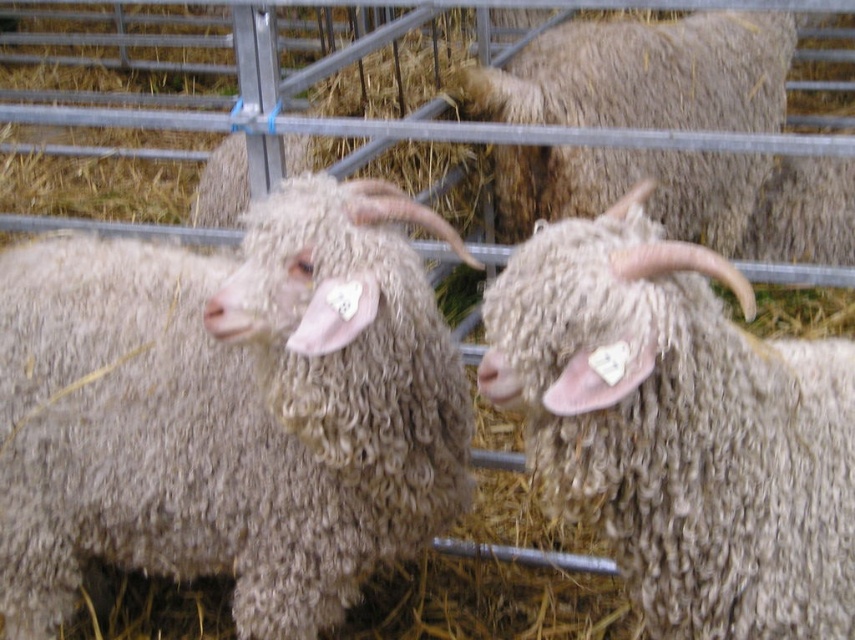
Question: Which point is farther to the camera?

Choices:
 (A) fluffy woolen sheep at upper right
 (B) fuzzy woolen sheep at center
 (C) curly woolen sheep at center

Answer: (A)

Question: Does curly woolen sheep at center have a lesser width compared to fluffy woolen sheep at upper right?

Choices:
 (A) no
 (B) yes

Answer: (B)

Question: Which object appears closest to the camera in this image?

Choices:
 (A) fluffy woolen sheep at upper right
 (B) fuzzy woolen sheep at center

Answer: (B)

Question: Is curly woolen sheep at center behind fuzzy woolen sheep at center?

Choices:
 (A) no
 (B) yes

Answer: (B)

Question: Which point appears farthest from the camera in this image?

Choices:
 (A) (641, 497)
 (B) (656, 93)
 (C) (38, 336)

Answer: (B)

Question: Is curly woolen sheep at center thinner than fuzzy woolen sheep at center?

Choices:
 (A) yes
 (B) no

Answer: (B)